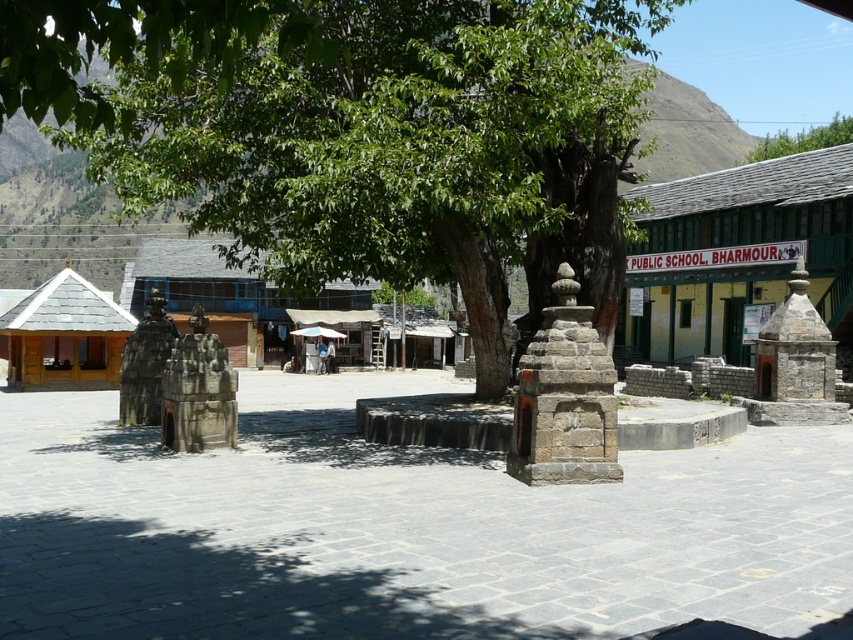
Question: Which point appears farthest from the camera in this image?

Choices:
 (A) (219, 189)
 (B) (763, 147)

Answer: (B)

Question: Which point appears farthest from the camera in this image?

Choices:
 (A) (822, 132)
 (B) (343, 77)

Answer: (A)

Question: Is gray stone stupa at center below green leafy tree at upper right?

Choices:
 (A) yes
 (B) no

Answer: (A)

Question: Can you confirm if green leafy tree at center is wider than green leafy tree at upper right?

Choices:
 (A) yes
 (B) no

Answer: (A)

Question: Does green leafy tree at center appear on the left side of gray stone stupa at center?

Choices:
 (A) yes
 (B) no

Answer: (B)

Question: Which point is farther to the camera?

Choices:
 (A) gray stone stupa at center
 (B) green leafy tree at center

Answer: (A)